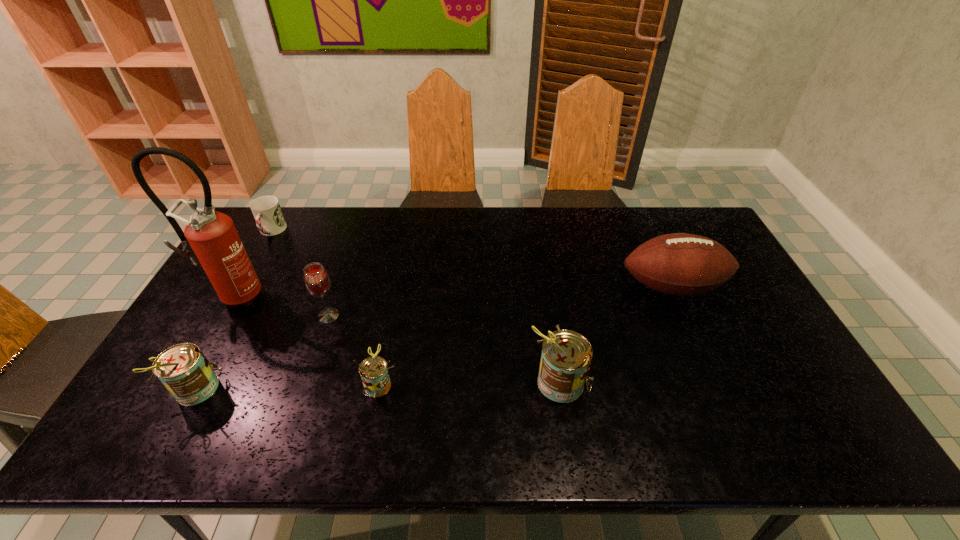
The image size is (960, 540). Identify the location of the second tallest can. (184, 370).

Find the location of a particular element. The height and width of the screenshot is (540, 960). the second can from left to right is located at coordinates (373, 370).

Identify the location of the shortest can. (373, 370).

You are a GUI agent. You are given a task and a screenshot of the screen. Output one action in this format:
    pyautogui.click(x=<x>, y=<y>)
    Task: Click on the rightmost can
    This screenshot has height=540, width=960.
    Given the screenshot: What is the action you would take?
    pyautogui.click(x=566, y=355)

Locate an element on the screen. This screenshot has height=540, width=960. cup is located at coordinates (267, 212).

Identify the location of the rightmost object. (679, 264).

Locate an element on the screen. The width and height of the screenshot is (960, 540). wineglass is located at coordinates (316, 279).

Locate an element on the screen. fire extinguisher is located at coordinates (210, 238).

Find the location of a particular element. blank space located 0.340m on the right of the second tallest can is located at coordinates (357, 388).

The width and height of the screenshot is (960, 540). I want to click on vacant space located on the back of the fifth object from left to right, so click(400, 272).